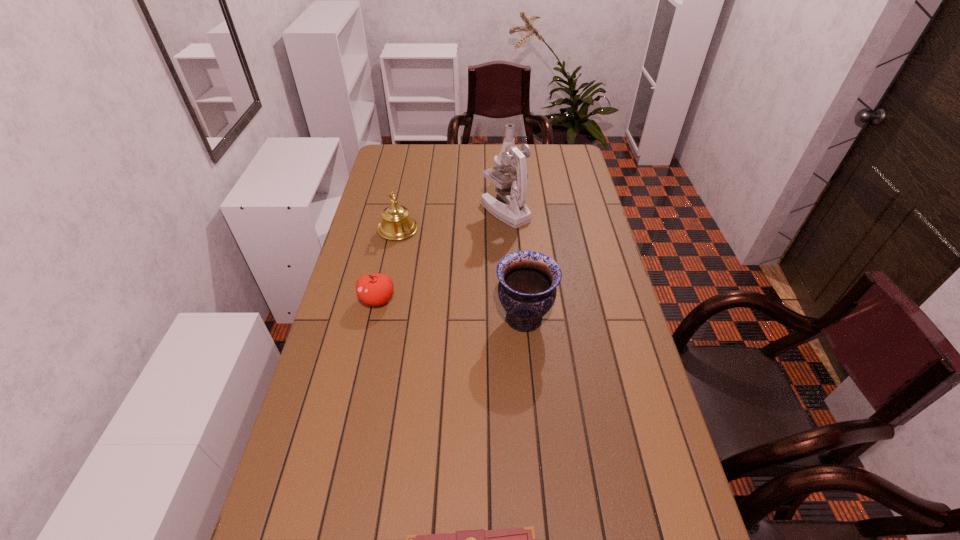
Locate an element on the screen. free spot between the bell and the microscope is located at coordinates (451, 220).

This screenshot has height=540, width=960. Identify the location of free space between the microscope and the second shortest object. (442, 255).

The width and height of the screenshot is (960, 540). I want to click on the fourth closest object to the shortest object, so click(x=512, y=189).

What are the coordinates of `the closest object to the fourth tallest object` in the screenshot? It's located at click(x=396, y=224).